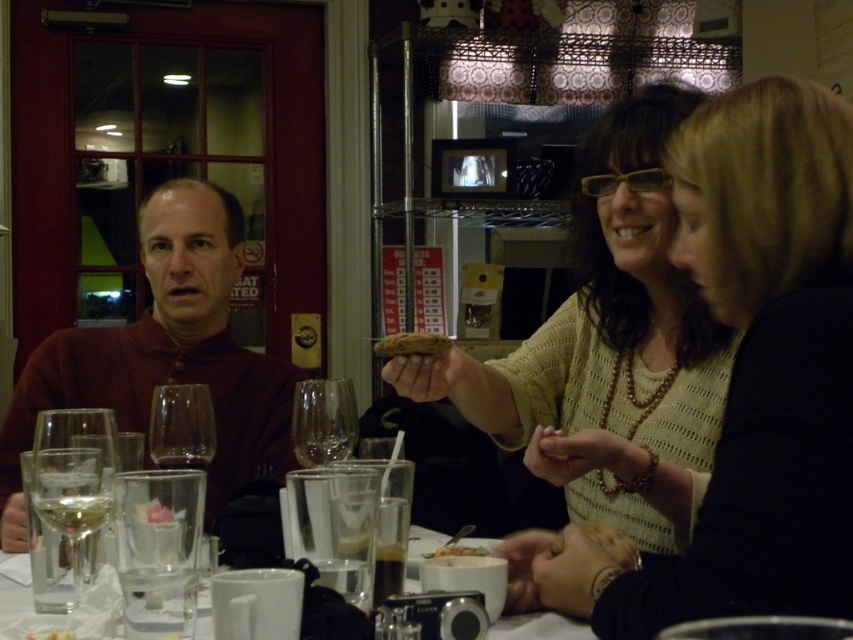
Question: Which point is farther from the camera taking this photo?

Choices:
 (A) [x=780, y=246]
 (B) [x=444, y=554]
 (C) [x=602, y=154]

Answer: (C)

Question: Is matte brown shirt at left below brown crumbly bread at center?

Choices:
 (A) no
 (B) yes

Answer: (B)

Question: Is knitted beige sweater at center bigger than matte brown shirt at left?

Choices:
 (A) yes
 (B) no

Answer: (B)

Question: From the image, what is the correct spatial relationship of white glossy mug at lower center in relation to white creamy soup at center?

Choices:
 (A) right
 (B) left

Answer: (A)

Question: Considering the real-world distances, which object is farthest from the knitted beige sweater at upper right?

Choices:
 (A) knitted beige sweater at center
 (B) white creamy pasta at center

Answer: (B)

Question: Which of these objects is positioned farthest from the white glossy mug at lower center?

Choices:
 (A) brown crumbly bread at center
 (B) knitted beige sweater at center

Answer: (A)